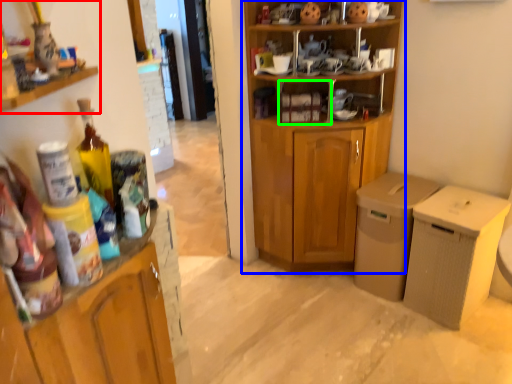
Question: Estimate the real-world distances between objects in this image. Which object is farther from cabinetry (highlighted by a red box), cupboard (highlighted by a blue box) or cabinet (highlighted by a green box)?

Choices:
 (A) cupboard
 (B) cabinet

Answer: (A)